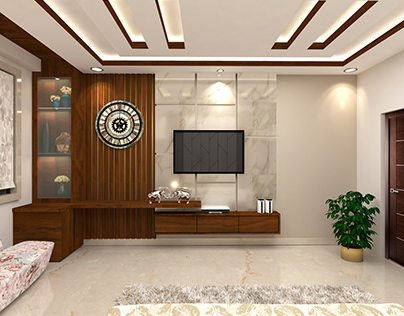
Image resolution: width=404 pixels, height=316 pixels. What are the coordinates of `baseboard trim` in the screenshot? It's located at (306, 241).